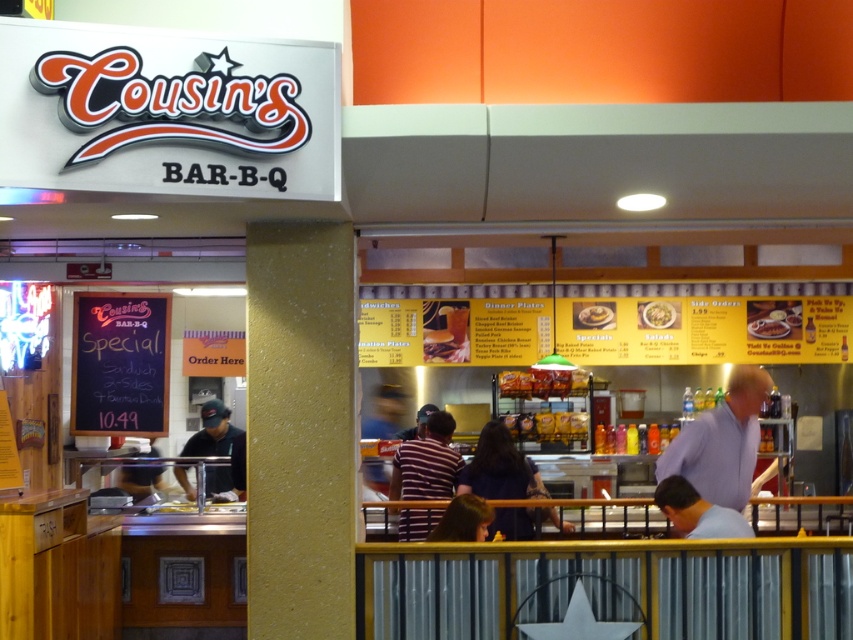
Question: Is light blue shirt at center positioned in front of dark blue baseball cap at center?

Choices:
 (A) yes
 (B) no

Answer: (A)

Question: Which point is closer to the camera?

Choices:
 (A) (509, 454)
 (B) (306, 536)

Answer: (B)

Question: Which point is farther from the camera taking this photo?

Choices:
 (A) (225, 435)
 (B) (700, 512)

Answer: (A)

Question: Which point is farther from the camera taking this photo?

Choices:
 (A) click(398, 435)
 (B) click(737, 461)
 (C) click(201, 416)

Answer: (A)

Question: Can you confirm if light blue shirt at center is positioned above yellow matte pancake at center?

Choices:
 (A) no
 (B) yes

Answer: (A)

Question: Is light blue shirt at center positioned at the back of matte black shirt at center?

Choices:
 (A) no
 (B) yes

Answer: (A)